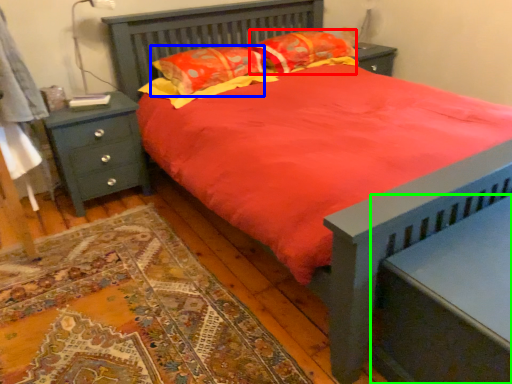
Question: Which object is the farthest from pillow (highlighted by a red box)? Choose among these: pillow (highlighted by a blue box) or nightstand (highlighted by a green box).

Choices:
 (A) pillow
 (B) nightstand

Answer: (B)